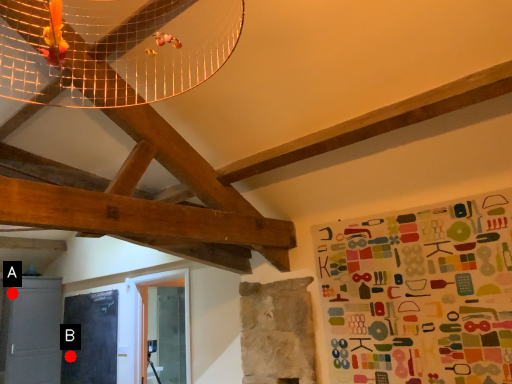
Question: Two points are circled on the image, labeled by A and B beside each circle. Which point appears closest to the camera in this image?

Choices:
 (A) A is closer
 (B) B is closer

Answer: (A)